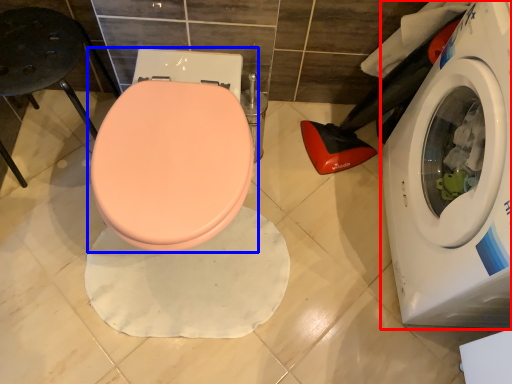
Question: Which object appears farthest to the camera in this image, washing machine (highlighted by a red box) or toilet (highlighted by a blue box)?

Choices:
 (A) washing machine
 (B) toilet

Answer: (B)